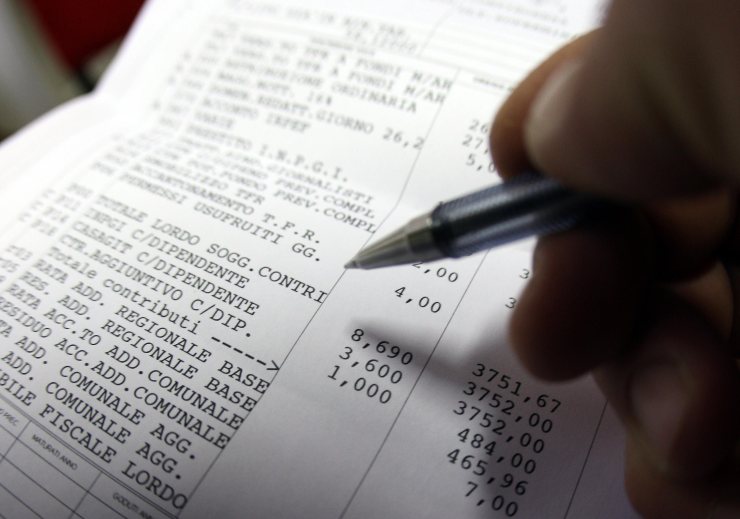
Identify the location of document. This screenshot has width=740, height=519. [x=297, y=472].